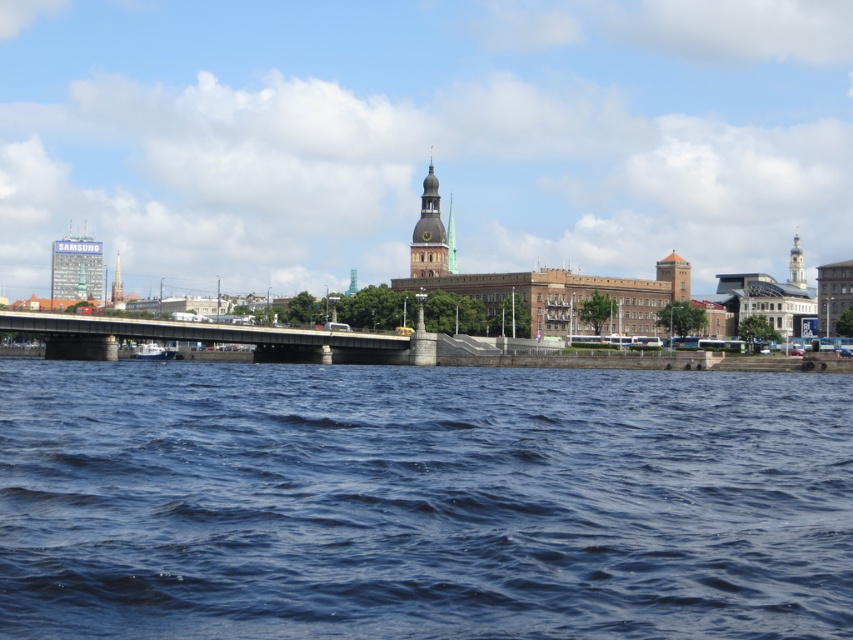
Question: Based on their relative distances, which object is nearer to the smooth silver tower at upper center?

Choices:
 (A) blue glass tower at upper left
 (B) smooth stone tower at center
 (C) blue water at lower center

Answer: (B)

Question: Based on their relative distances, which object is nearer to the blue glass tower at upper left?

Choices:
 (A) metallic bridge at center
 (B) blue water at lower center

Answer: (A)

Question: Which point is closer to the camera taking this photo?

Choices:
 (A) (115, 291)
 (B) (792, 276)
 (C) (416, 360)

Answer: (C)

Question: Does smooth silver tower at upper center appear on the right side of brushed metal tower at left?

Choices:
 (A) yes
 (B) no

Answer: (A)

Question: Does smooth silver tower at upper center have a larger size compared to brushed metal tower at left?

Choices:
 (A) yes
 (B) no

Answer: (B)

Question: From the image, what is the correct spatial relationship of blue water at lower center in relation to smooth silver tower at upper center?

Choices:
 (A) left
 (B) right

Answer: (A)